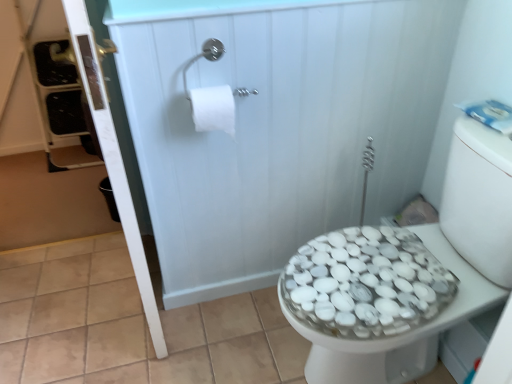
Question: Is white glossy shower door at upper left wider than white matte toilet paper at upper center?

Choices:
 (A) no
 (B) yes

Answer: (A)

Question: From the image's perspective, is white glossy shower door at upper left under white matte toilet paper at upper center?

Choices:
 (A) no
 (B) yes

Answer: (B)

Question: Does white glossy shower door at upper left have a smaller size compared to white matte toilet paper at upper center?

Choices:
 (A) no
 (B) yes

Answer: (A)

Question: From the image's perspective, would you say white glossy shower door at upper left is positioned over white matte toilet paper at upper center?

Choices:
 (A) yes
 (B) no

Answer: (B)

Question: From a real-world perspective, is white glossy shower door at upper left located beneath white matte toilet paper at upper center?

Choices:
 (A) no
 (B) yes

Answer: (B)

Question: From the image's perspective, is white matte toilet paper at upper center above or below white pebble-patterned bidet at right?

Choices:
 (A) above
 (B) below

Answer: (A)

Question: In terms of width, does white matte toilet paper at upper center look wider or thinner when compared to white pebble-patterned bidet at right?

Choices:
 (A) thin
 (B) wide

Answer: (A)

Question: From a real-world perspective, is white matte toilet paper at upper center physically located above or below white pebble-patterned bidet at right?

Choices:
 (A) below
 (B) above

Answer: (B)

Question: Visually, is white matte toilet paper at upper center positioned to the left or to the right of white pebble-patterned bidet at right?

Choices:
 (A) right
 (B) left

Answer: (B)

Question: Considering the positions of point (185, 228) and point (400, 345), is point (185, 228) closer or farther from the camera than point (400, 345)?

Choices:
 (A) closer
 (B) farther

Answer: (B)

Question: Considering the positions of white glossy shower door at upper left and white pebble-patterned bidet at right in the image, is white glossy shower door at upper left taller or shorter than white pebble-patterned bidet at right?

Choices:
 (A) tall
 (B) short

Answer: (A)

Question: Choose the correct answer: Is white glossy shower door at upper left inside white pebble-patterned bidet at right or outside it?

Choices:
 (A) inside
 (B) outside

Answer: (B)

Question: Is white glossy shower door at upper left to the left or to the right of white pebble-patterned bidet at right in the image?

Choices:
 (A) left
 (B) right

Answer: (A)

Question: Looking at their shapes, would you say white glossy shower door at upper left is wider or thinner than white matte toilet paper at upper center?

Choices:
 (A) wide
 (B) thin

Answer: (B)

Question: Relative to white matte toilet paper at upper center, is white glossy shower door at upper left in front or behind?

Choices:
 (A) behind
 (B) front

Answer: (B)